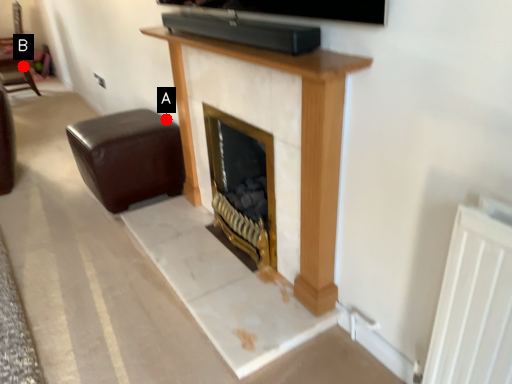
Question: Two points are circled on the image, labeled by A and B beside each circle. Which of the following is the closest to the observer?

Choices:
 (A) A is closer
 (B) B is closer

Answer: (A)